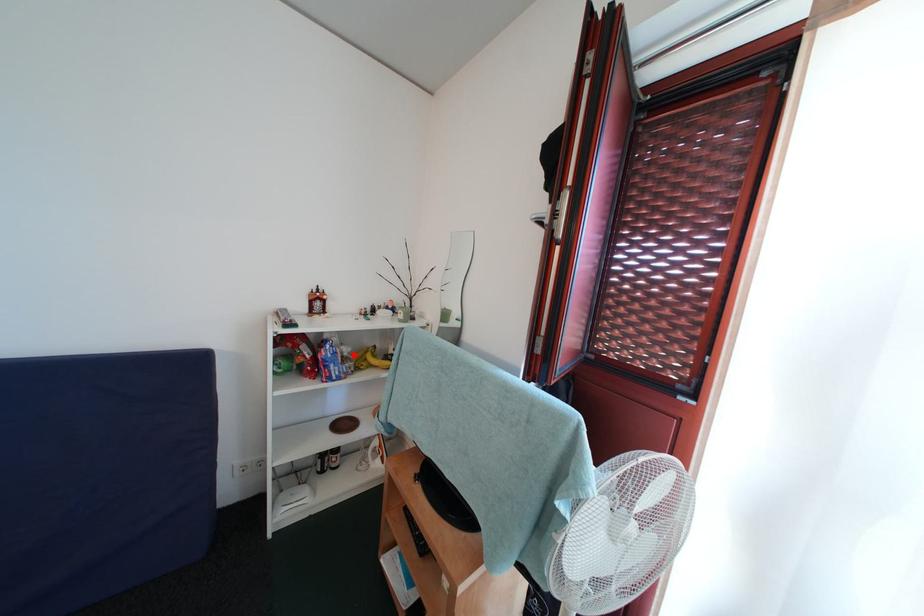
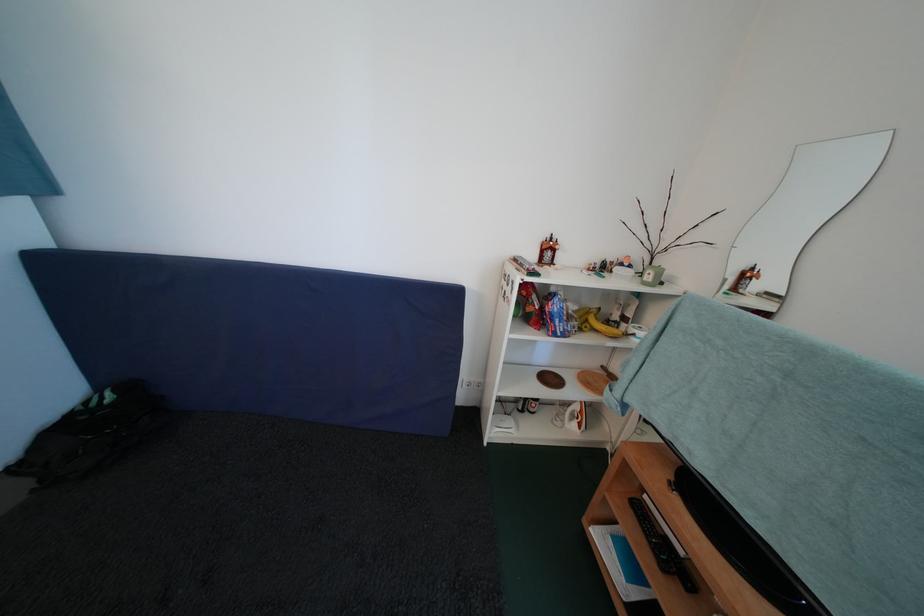
The point at the highlighted location is marked in the first image. Where is the corresponding point in the second image?

(579, 313)